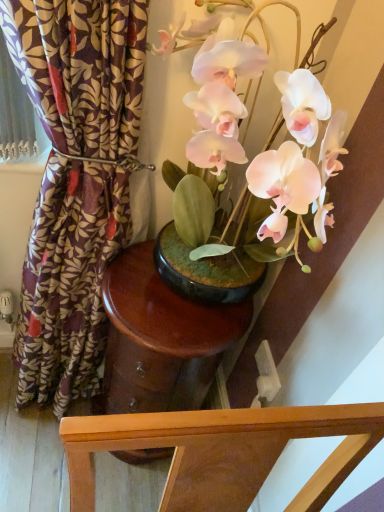
The height and width of the screenshot is (512, 384). Find the location of `free space above glossy wood side table at center (from a real-world perspective)`. free space above glossy wood side table at center (from a real-world perspective) is located at coordinates (166, 303).